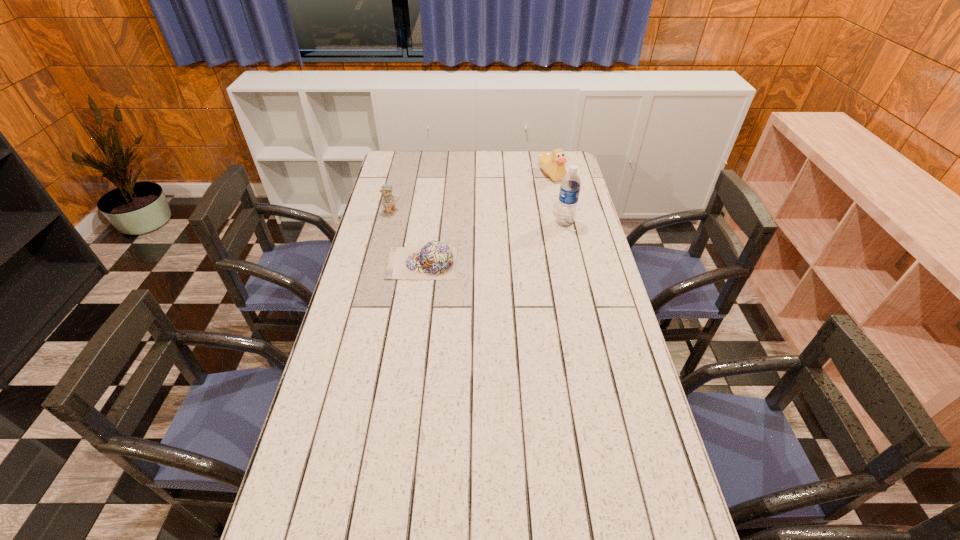
The height and width of the screenshot is (540, 960). I want to click on vacant space on the desktop that is between the nearest object and the second nearest object and is positioned on the front-facing side of the second farthest object, so click(476, 248).

Identify the location of vacant space on the desktop that is between the shortest object and the tallest object and is positioned at the beak of the duck. Image resolution: width=960 pixels, height=540 pixels. (515, 237).